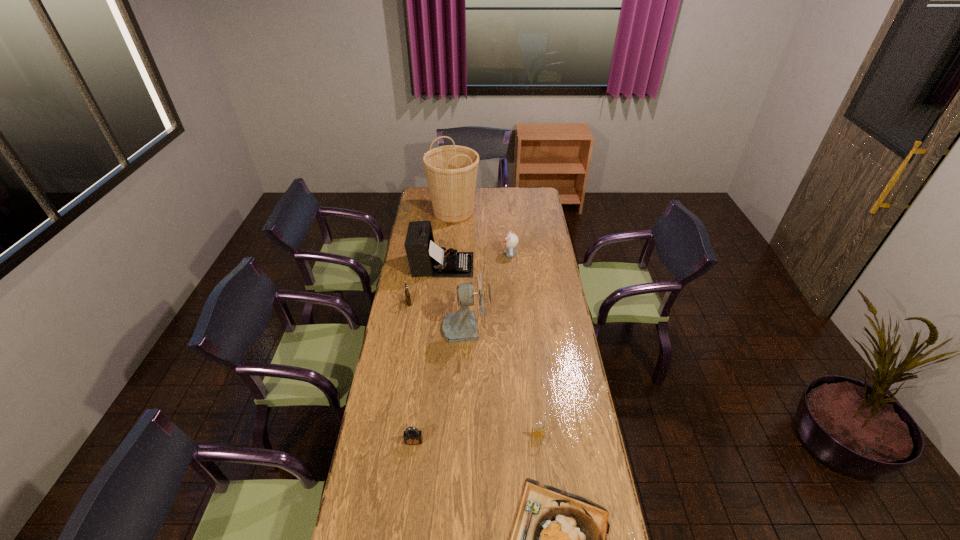
Where is `the farthest object`? The height and width of the screenshot is (540, 960). the farthest object is located at coordinates (451, 170).

What are the coordinates of `basket` in the screenshot? It's located at (451, 170).

I want to click on fan, so click(461, 326).

Locate an element on the screen. typewriter is located at coordinates (425, 258).

Locate an element on the screen. Image resolution: width=960 pixels, height=540 pixels. kitten is located at coordinates (511, 240).

You are a GUI agent. You are given a task and a screenshot of the screen. Output one action in this format:
    pyautogui.click(x=<x>, y=<y>)
    Task: Click on the leftmost padlock
    
    Given the screenshot: What is the action you would take?
    pyautogui.click(x=407, y=295)

Image resolution: width=960 pixels, height=540 pixels. What are the coordinates of `the fourth shortest object` in the screenshot? It's located at (407, 295).

Find the location of a particular element. The image size is (960, 540). the second padlock from right to left is located at coordinates click(x=412, y=436).

You are a GUI agent. You are given a task and a screenshot of the screen. Output one action in this format:
    pyautogui.click(x=<x>, y=<y>)
    Task: Click on the rightmost padlock
    The height and width of the screenshot is (540, 960).
    Given the screenshot: What is the action you would take?
    click(x=535, y=431)

Where is `free space located 0.120m on the front of the farthest object`? The image size is (960, 540). free space located 0.120m on the front of the farthest object is located at coordinates (451, 240).